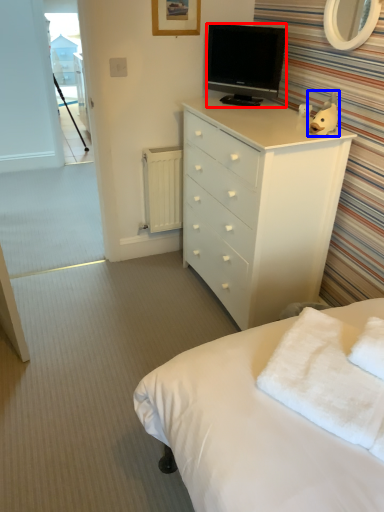
Question: Among these objects, which one is farthest to the camera, television (highlighted by a red box) or toy (highlighted by a blue box)?

Choices:
 (A) television
 (B) toy

Answer: (A)